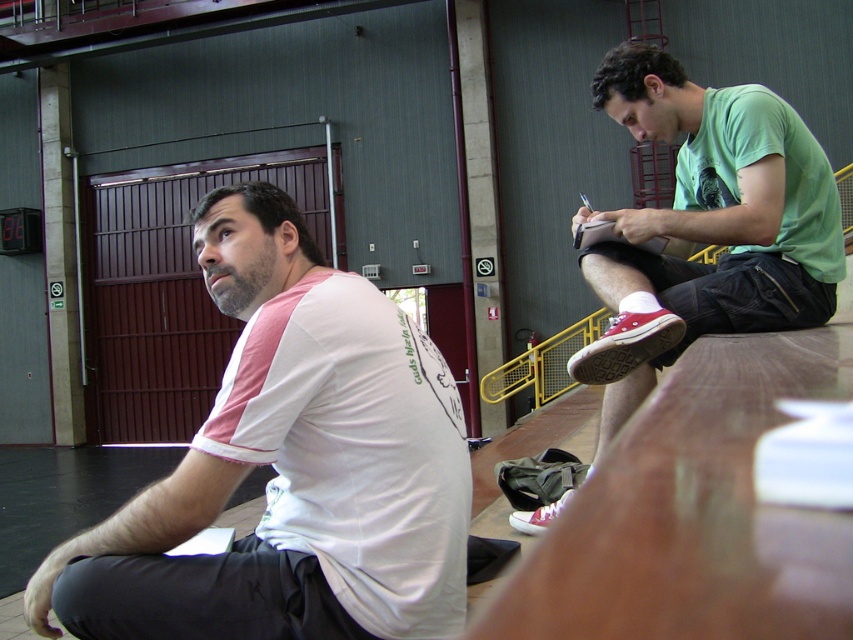
Question: Based on their relative distances, which object is nearer to the red canvas shoe at lower right?

Choices:
 (A) matte white shoe at lower center
 (B) green matte shirt at upper right
 (C) white fabric shirt at left

Answer: (B)

Question: Can you confirm if red canvas shoe at lower right is positioned to the left of matte white shoe at lower center?

Choices:
 (A) yes
 (B) no

Answer: (B)

Question: Does green matte shirt at upper right have a larger size compared to matte white shoe at lower center?

Choices:
 (A) yes
 (B) no

Answer: (A)

Question: Does white fabric shirt at left appear on the right side of green matte shirt at upper right?

Choices:
 (A) yes
 (B) no

Answer: (B)

Question: Considering the real-world distances, which object is closest to the matte white shoe at lower center?

Choices:
 (A) red canvas shoe at lower right
 (B) green matte shirt at upper right
 (C) white fabric shirt at left

Answer: (A)

Question: Based on their relative distances, which object is nearer to the matte white shoe at lower center?

Choices:
 (A) red canvas shoe at lower right
 (B) green matte shirt at upper right
 (C) white fabric shirt at left

Answer: (A)